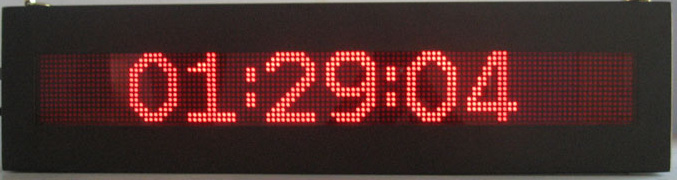
Locate an element on the screen. corner is located at coordinates (671, 14), (668, 171), (9, 16), (15, 173).